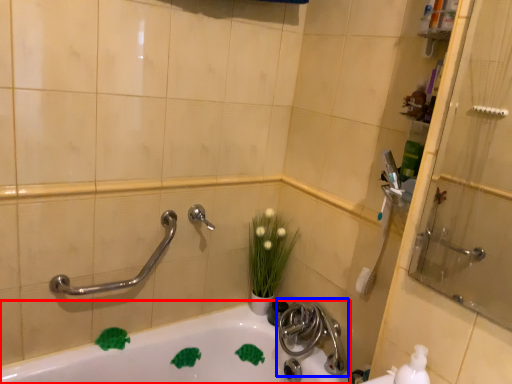
Question: Which point is closer to the camera, bathtub (highlighted by a red box) or tap (highlighted by a blue box)?

Choices:
 (A) bathtub
 (B) tap

Answer: (A)